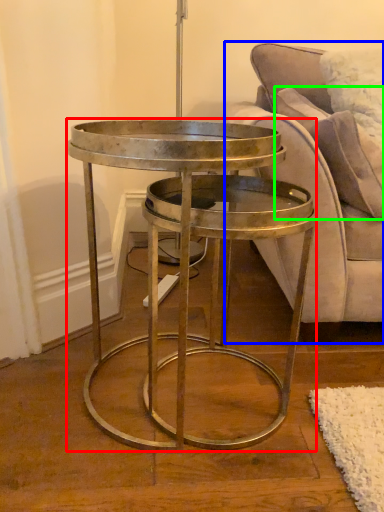
Question: Based on their relative distances, which object is nearer to coffee table (highlighted by a red box)? Choose from studio couch (highlighted by a blue box) and pillow (highlighted by a green box).

Choices:
 (A) studio couch
 (B) pillow

Answer: (A)